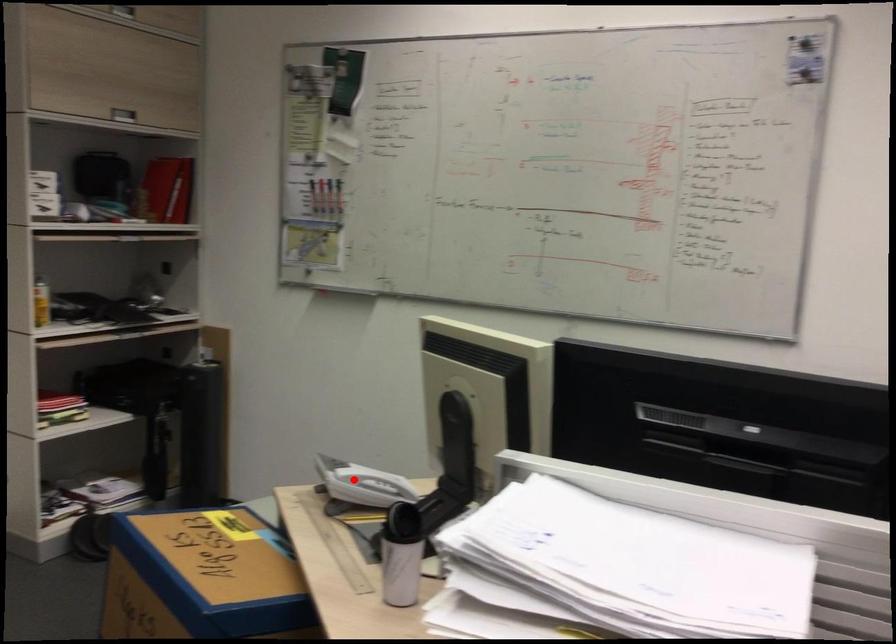
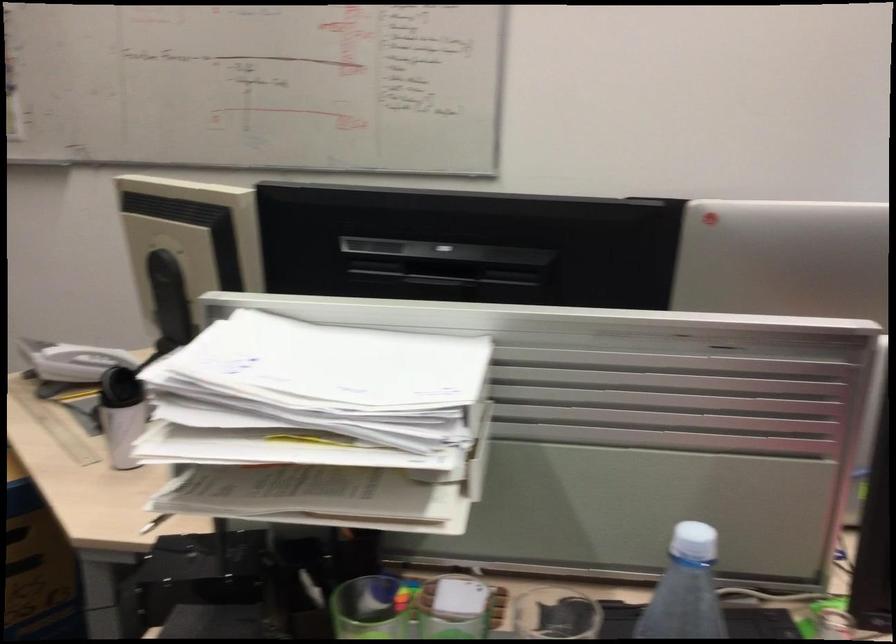
Find the pixel in the second image that matches the highlighted location in the first image.

(72, 361)